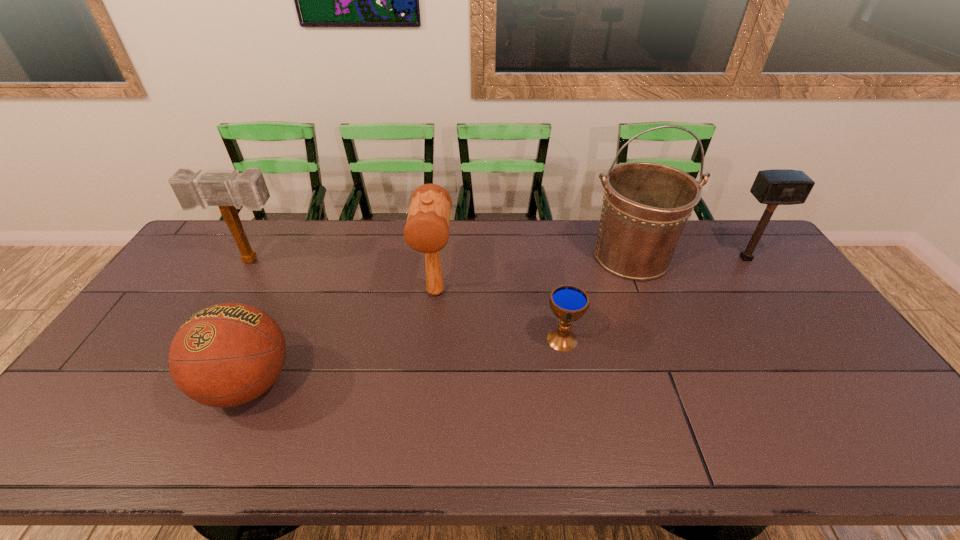
Find the location of a particular element. the tallest object is located at coordinates (646, 205).

The height and width of the screenshot is (540, 960). I want to click on the fifth object from left to right, so click(x=646, y=205).

This screenshot has height=540, width=960. Identify the location of the nearest mallet. (427, 227).

The height and width of the screenshot is (540, 960). I want to click on the third object from left to right, so click(427, 227).

I want to click on the leftmost mallet, so click(x=229, y=191).

This screenshot has width=960, height=540. I want to click on the rightmost mallet, so pos(774,187).

The image size is (960, 540). I want to click on the fifth tallest object, so click(x=228, y=354).

Image resolution: width=960 pixels, height=540 pixels. I want to click on the fourth object from left to right, so click(x=569, y=303).

This screenshot has width=960, height=540. Identify the location of the shortest object. (569, 303).

This screenshot has height=540, width=960. What are the coordinates of `vacant space situated 0.160m on the front of the bucket` in the screenshot? It's located at coord(659,324).